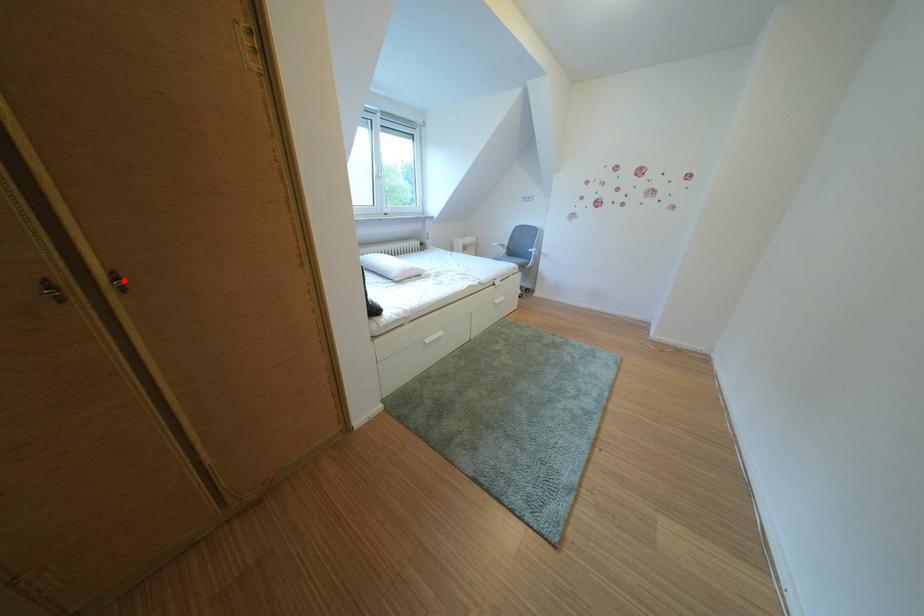
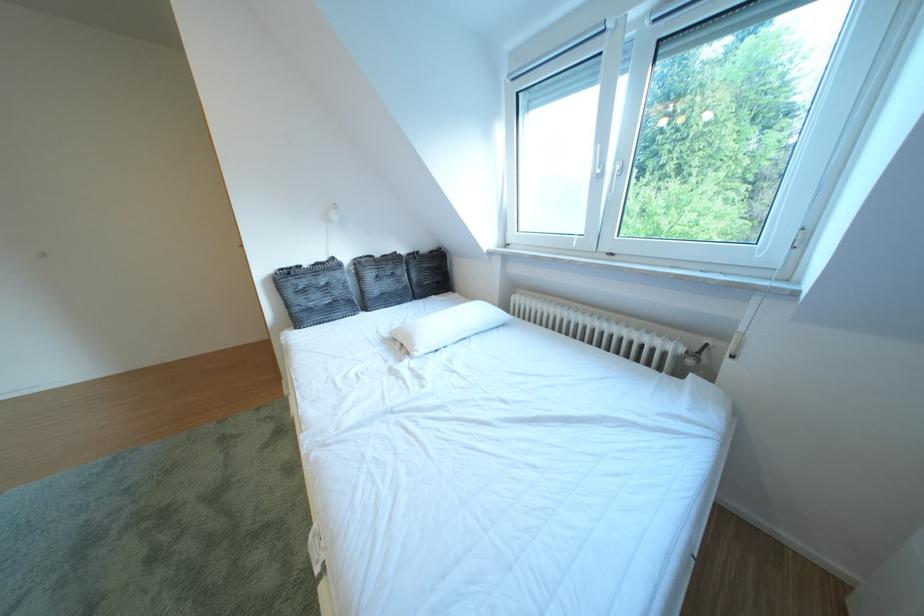
Question: I am providing you with two images of the same scene from different viewpoints. A red point is marked on the first image. Is the red point's position out of view in image 2?

Choices:
 (A) Yes
 (B) No

Answer: (A)